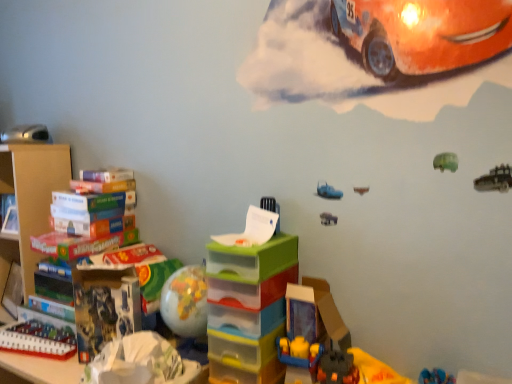
Question: From a real-world perspective, is translucent plastic toy at lower center, which appears as the first toy when viewed from the right, on translucent plastic building blocks at lower left, placed as the 3th toy when sorted from right to left?

Choices:
 (A) yes
 (B) no

Answer: (A)

Question: Is translucent plastic toy at lower center, placed as the third toy when sorted from bottom to top, taller than translucent plastic building blocks at lower left, the first toy from the bottom?

Choices:
 (A) no
 (B) yes

Answer: (B)

Question: Is translucent plastic toy at lower center, placed as the third toy when sorted from bottom to top, shorter than translucent plastic building blocks at lower left, placed as the 3th toy when sorted from right to left?

Choices:
 (A) no
 (B) yes

Answer: (A)

Question: Is the position of translucent plastic toy at lower center, placed as the third toy when sorted from bottom to top, less distant than that of translucent plastic building blocks at lower left, which appears as the second toy when viewed from the left?

Choices:
 (A) yes
 (B) no

Answer: (A)

Question: Does translucent plastic toy at lower center, the 2th toy from the top, turn towards translucent plastic building blocks at lower left, which appears as the second toy when viewed from the left?

Choices:
 (A) no
 (B) yes

Answer: (A)

Question: Considering the positions of point (55, 342) and point (251, 258), is point (55, 342) closer or farther from the camera than point (251, 258)?

Choices:
 (A) farther
 (B) closer

Answer: (A)

Question: Is translucent plastic building blocks at lower left, the first toy from the bottom, wider or thinner than translucent plastic drawers at center, marked as the 2th toy in a bottom-to-top arrangement?

Choices:
 (A) wide
 (B) thin

Answer: (B)

Question: From a real-world perspective, is translucent plastic building blocks at lower left, the first toy from the bottom, positioned above or below translucent plastic drawers at center, the 3th toy from the top?

Choices:
 (A) below
 (B) above

Answer: (A)

Question: Is translucent plastic building blocks at lower left, the first toy from the bottom, bigger or smaller than translucent plastic drawers at center, the 3th toy from the top?

Choices:
 (A) big
 (B) small

Answer: (B)

Question: From a real-world perspective, is translucent plastic toy at lower center, placed as the third toy when sorted from bottom to top, positioned above or below translucent plastic building blocks at lower left, the first toy from the bottom?

Choices:
 (A) below
 (B) above

Answer: (B)

Question: Is translucent plastic toy at lower center, which is the fourth toy in left-to-right order, spatially inside translucent plastic building blocks at lower left, which appears as the second toy when viewed from the left, or outside of it?

Choices:
 (A) inside
 (B) outside

Answer: (B)

Question: In terms of height, does translucent plastic toy at lower center, which is the fourth toy in left-to-right order, look taller or shorter compared to translucent plastic building blocks at lower left, the first toy from the bottom?

Choices:
 (A) tall
 (B) short

Answer: (A)

Question: Is translucent plastic toy at lower center, the 2th toy from the top, in front of or behind translucent plastic building blocks at lower left, the first toy from the bottom, in the image?

Choices:
 (A) behind
 (B) front

Answer: (B)

Question: Considering the positions of translucent plastic drawers at center, the 3th toy from the top, and translucent plastic toy at lower center, which is the fourth toy in left-to-right order, in the image, is translucent plastic drawers at center, the 3th toy from the top, wider or thinner than translucent plastic toy at lower center, which is the fourth toy in left-to-right order,?

Choices:
 (A) thin
 (B) wide

Answer: (B)

Question: From a real-world perspective, is translucent plastic drawers at center, marked as the 2th toy in a bottom-to-top arrangement, physically located above or below translucent plastic toy at lower center, placed as the third toy when sorted from bottom to top?

Choices:
 (A) below
 (B) above

Answer: (A)